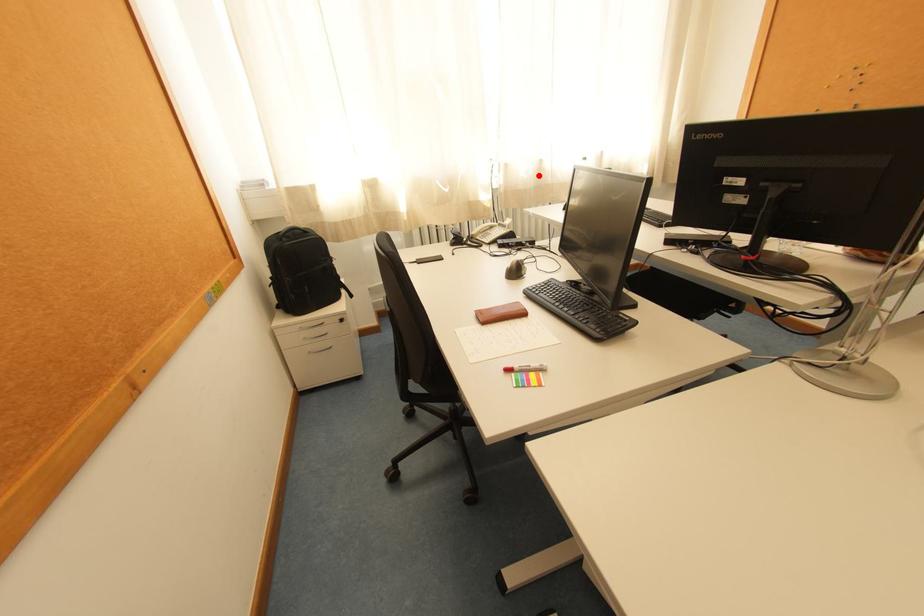
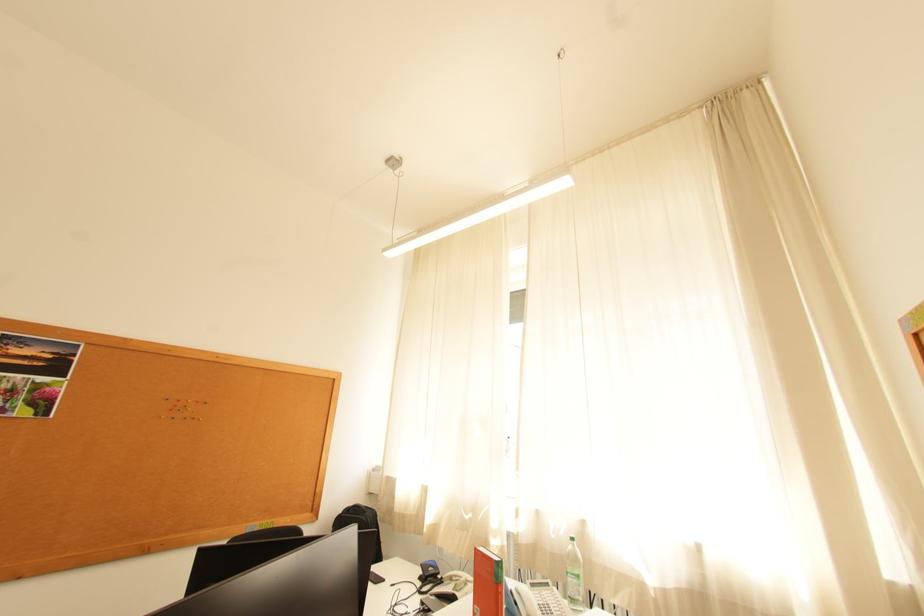
Question: I am providing you with two images of the same scene from different viewpoints. A red point is marked on the first image. Can you still see the location of the red point in image 2?

Choices:
 (A) Yes
 (B) No

Answer: (A)